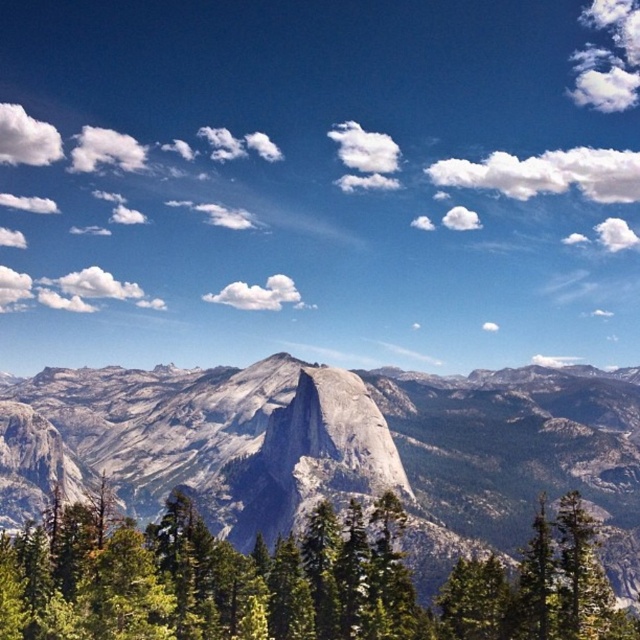
Who is higher up, granite mountain range at center or green matte tree at lower right?

granite mountain range at center

This screenshot has height=640, width=640. Describe the element at coordinates (337, 449) in the screenshot. I see `granite mountain range at center` at that location.

Identify the location of granite mountain range at center. (337, 449).

Which is more to the left, granite mountain range at center or green textured tree at center?

Positioned to the left is granite mountain range at center.

Which is behind, point (108, 400) or point (45, 618)?

Positioned behind is point (108, 400).

Where is `granite mountain range at center`? granite mountain range at center is located at coordinates (337, 449).

Which is behind, point (196, 532) or point (528, 609)?

Positioned behind is point (196, 532).

Which is in front, point (106, 596) or point (531, 538)?

Point (106, 596)

Locate an element on the screen. This screenshot has width=640, height=640. green textured tree at center is located at coordinates (292, 580).

Locate an element on the screen. This screenshot has height=640, width=640. green textured tree at center is located at coordinates (292, 580).